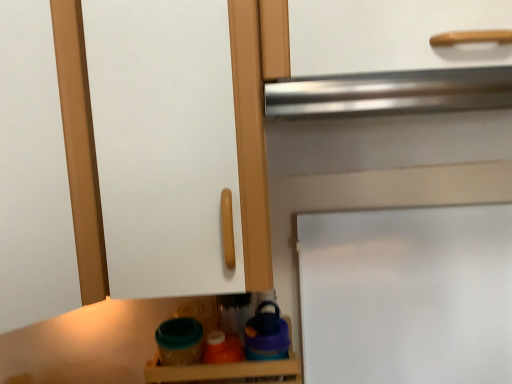
Question: From a real-world perspective, is white matte door at center physically below translucent plastic containers at lower center?

Choices:
 (A) no
 (B) yes

Answer: (A)

Question: Is white matte door at center smaller than translucent plastic containers at lower center?

Choices:
 (A) yes
 (B) no

Answer: (B)

Question: Is there a large distance between white matte door at center and translucent plastic containers at lower center?

Choices:
 (A) no
 (B) yes

Answer: (A)

Question: Considering the relative sizes of white matte door at center and translucent plastic containers at lower center in the image provided, is white matte door at center shorter than translucent plastic containers at lower center?

Choices:
 (A) no
 (B) yes

Answer: (A)

Question: Is white matte door at center to the right of translucent plastic containers at lower center from the viewer's perspective?

Choices:
 (A) yes
 (B) no

Answer: (A)

Question: Is white matte door at center beside translucent plastic containers at lower center?

Choices:
 (A) yes
 (B) no

Answer: (B)

Question: Is translucent plastic containers at lower center to the left of white matte door at center from the viewer's perspective?

Choices:
 (A) yes
 (B) no

Answer: (A)

Question: Considering the relative sizes of translucent plastic containers at lower center and white matte door at center in the image provided, is translucent plastic containers at lower center wider than white matte door at center?

Choices:
 (A) no
 (B) yes

Answer: (B)

Question: From a real-world perspective, is translucent plastic containers at lower center beneath white matte door at center?

Choices:
 (A) no
 (B) yes

Answer: (B)

Question: Considering the relative positions of translucent plastic containers at lower center and white matte door at center in the image provided, is translucent plastic containers at lower center behind white matte door at center?

Choices:
 (A) yes
 (B) no

Answer: (B)

Question: Does translucent plastic containers at lower center have a greater height compared to white matte door at center?

Choices:
 (A) yes
 (B) no

Answer: (B)

Question: From a real-world perspective, does translucent plastic containers at lower center stand above white matte door at center?

Choices:
 (A) yes
 (B) no

Answer: (B)

Question: Would you say translucent plastic containers at lower center is to the left or to the right of white matte door at center in the picture?

Choices:
 (A) left
 (B) right

Answer: (A)